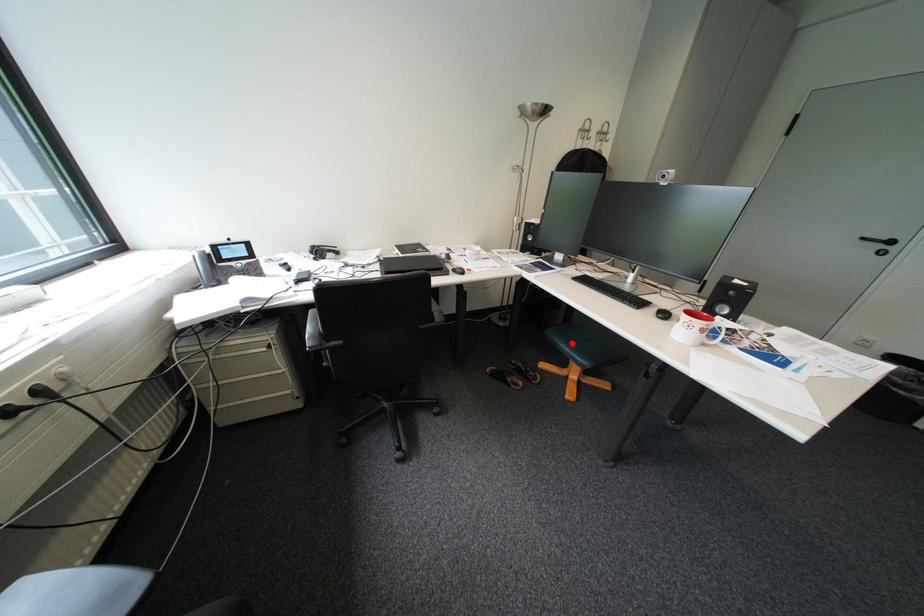
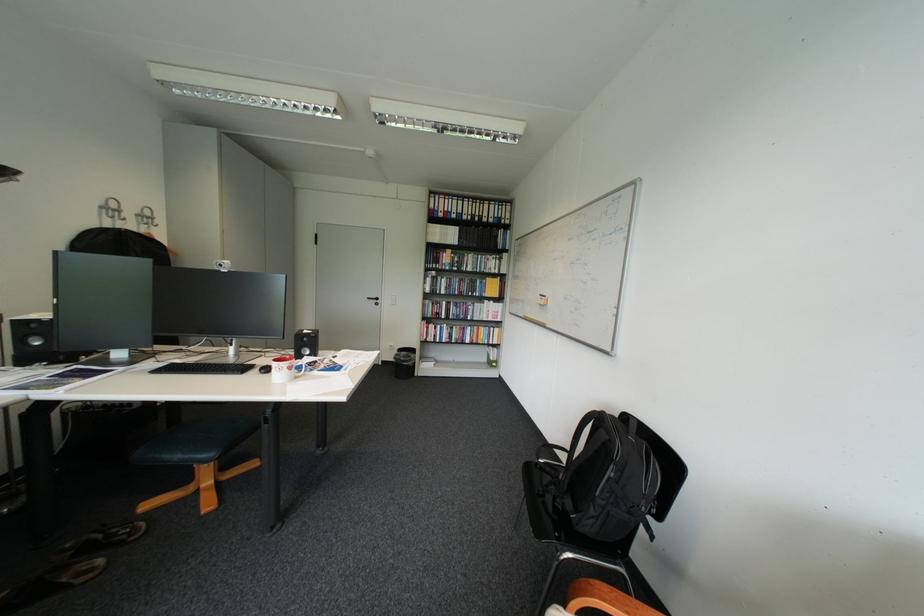
The point at the highlighted location is marked in the first image. Where is the corresponding point in the second image?

(176, 456)